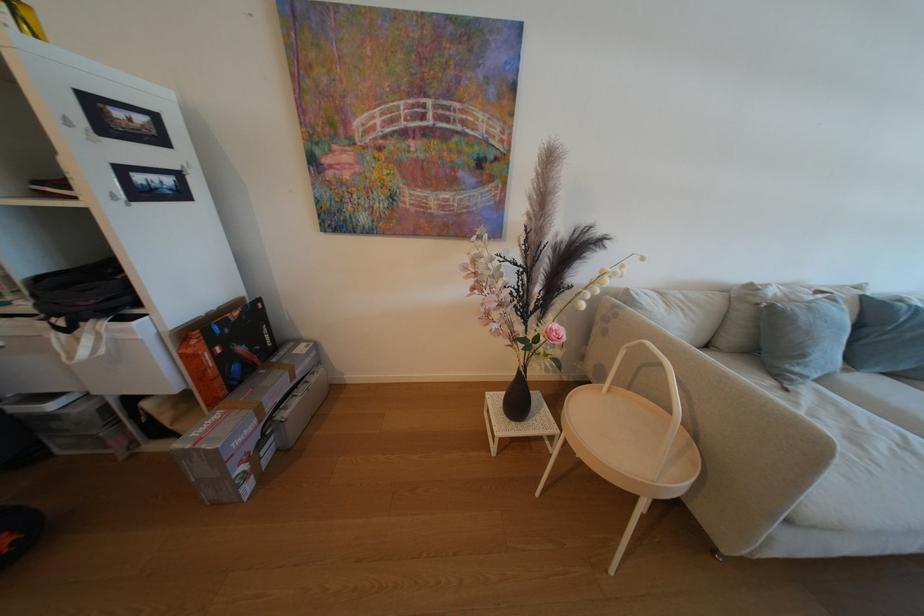
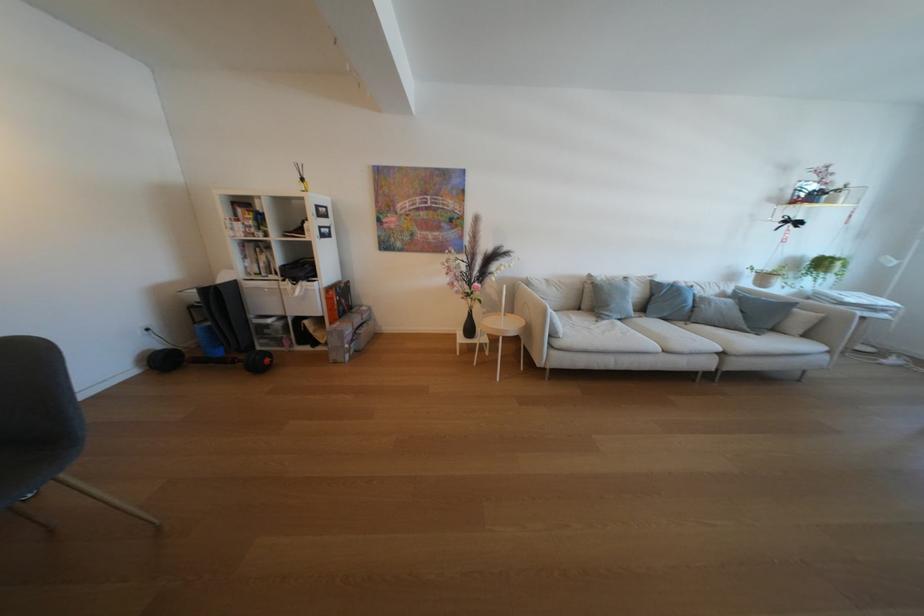
Find the pixel in the second image that matches [62,455] in the first image.

(265, 351)